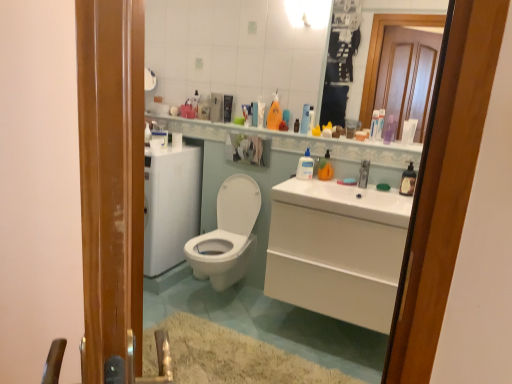
Where is `clear plastic bottle at upper center, which is counted as the first toiletry, starting from the right`? The height and width of the screenshot is (384, 512). clear plastic bottle at upper center, which is counted as the first toiletry, starting from the right is located at coordinates (390, 129).

What are the coordinates of `translucent plastic bottle at upper center, the 6th toiletry when ordered from right to left` in the screenshot? It's located at (296, 125).

How much space does translucent plastic bottle at upper center, the 6th toiletry when ordered from right to left, occupy vertically?

translucent plastic bottle at upper center, the 6th toiletry when ordered from right to left, is 4.13 inches in height.

Describe the element at coordinates (305, 119) in the screenshot. This screenshot has height=384, width=512. I see `clear plastic bottle at upper center, arranged as the fifth toiletry when viewed from the right` at that location.

What do you see at coordinates (227, 235) in the screenshot? I see `white glossy toilet at center` at bounding box center [227, 235].

What do you see at coordinates (359, 176) in the screenshot? I see `white glossy sink at upper center, arranged as the 2th sink when viewed from the left` at bounding box center [359, 176].

Identify the location of matte plastic bottle at upper center, which ranks as the eighth toiletry in right-to-left order. This screenshot has height=384, width=512. (246, 114).

From a real-world perspective, is clear plastic bottle at center, the second cleaning product when ordered from left to right, beneath white glossy shelf at upper center?

→ Yes, from a real-world perspective, clear plastic bottle at center, the second cleaning product when ordered from left to right, is below white glossy shelf at upper center.

Is clear plastic bottle at center, the 3th cleaning product when ordered from back to front, in contact with white glossy shelf at upper center?

No.

The height and width of the screenshot is (384, 512). I want to click on balustrade in front of the clear plastic bottle at center, the 3th cleaning product when ordered from back to front, so click(x=292, y=140).

Can you tell me how much clear plastic bottle at center, the second cleaning product when ordered from left to right, and white glossy shelf at upper center differ in facing direction?

clear plastic bottle at center, the second cleaning product when ordered from left to right, and white glossy shelf at upper center are facing 38.5 degrees away from each other.

Based on the photo, from the image's perspective, is matte plastic container at upper center, the 2th toiletry viewed from the left, under translucent plastic tube at upper center, the second toiletry in the right-to-left sequence?

No, from the image's perspective, matte plastic container at upper center, the 2th toiletry viewed from the left, is not beneath translucent plastic tube at upper center, the second toiletry in the right-to-left sequence.

Which object is more forward, matte plastic container at upper center, which is counted as the 7th toiletry, starting from the right, or translucent plastic tube at upper center, which appears as the 7th toiletry when viewed from the left?

translucent plastic tube at upper center, which appears as the 7th toiletry when viewed from the left, is more forward.

This screenshot has width=512, height=384. What are the coordinates of `the 3rd toiletry located beneath the translucent plastic tube at upper center, the second toiletry in the right-to-left sequence (from a real-world perspective)` in the screenshot? It's located at (260, 112).

Considering the relative sizes of matte plastic container at upper center, the 2th toiletry viewed from the left, and translucent plastic tube at upper center, which appears as the 7th toiletry when viewed from the left, in the image provided, is matte plastic container at upper center, the 2th toiletry viewed from the left, bigger than translucent plastic tube at upper center, which appears as the 7th toiletry when viewed from the left,?

Actually, matte plastic container at upper center, the 2th toiletry viewed from the left, might be smaller than translucent plastic tube at upper center, which appears as the 7th toiletry when viewed from the left.

Is white glossy shelf at upper center oriented towards white glossy light fixture at upper center?

No.

Is white glossy shelf at upper center with white glossy light fixture at upper center?

No, white glossy shelf at upper center is not with white glossy light fixture at upper center.

Considering the sizes of objects white glossy shelf at upper center and white glossy light fixture at upper center in the image provided, who is taller, white glossy shelf at upper center or white glossy light fixture at upper center?

With more height is white glossy light fixture at upper center.

Based on the photo, does white glossy toilet at center have a greater height compared to white glossy vanity at lower right?

Correct, white glossy toilet at center is much taller as white glossy vanity at lower right.

Which is less distant, (x=230, y=177) or (x=379, y=268)?

Point (x=230, y=177) is farther from the camera than point (x=379, y=268).

Considering the relative positions of white glossy toilet at center and white glossy vanity at lower right in the image provided, is white glossy toilet at center to the right of white glossy vanity at lower right from the viewer's perspective?

In fact, white glossy toilet at center is to the left of white glossy vanity at lower right.

What are the coordinates of `toilet that appears above the white glossy vanity at lower right (from the image's perspective)` in the screenshot? It's located at (227, 235).

Does point (361, 183) lie in front of point (304, 143)?

Yes, it is in front of point (304, 143).

Do you think white glossy sink at upper center, placed as the first sink when sorted from right to left, is within white glossy shelf at upper center, or outside of it?

white glossy sink at upper center, placed as the first sink when sorted from right to left, is located beyond the bounds of white glossy shelf at upper center.

Is white glossy sink at upper center, placed as the first sink when sorted from right to left, positioned behind white glossy shelf at upper center?

No, it is in front of white glossy shelf at upper center.

Starting from the white glossy sink at center, the 2th sink when ordered from right to left, which toiletry is the 8th one behind? Please provide its 2D coordinates.

[(246, 114)]

Considering the relative sizes of matte plastic bottle at upper center, which ranks as the eighth toiletry in right-to-left order, and white glossy sink at center, arranged as the first sink when viewed from the left, in the image provided, is matte plastic bottle at upper center, which ranks as the eighth toiletry in right-to-left order, taller than white glossy sink at center, arranged as the first sink when viewed from the left,?

Incorrect, the height of matte plastic bottle at upper center, which ranks as the eighth toiletry in right-to-left order, is not larger of that of white glossy sink at center, arranged as the first sink when viewed from the left.

Considering the positions of objects matte plastic bottle at upper center, marked as the 1th toiletry in a left-to-right arrangement, and white glossy sink at center, arranged as the first sink when viewed from the left, in the image provided, who is in front, matte plastic bottle at upper center, marked as the 1th toiletry in a left-to-right arrangement, or white glossy sink at center, arranged as the first sink when viewed from the left,?

white glossy sink at center, arranged as the first sink when viewed from the left.

Is matte plastic bottle at upper center, which ranks as the eighth toiletry in right-to-left order, wider or thinner than white glossy sink at center, arranged as the first sink when viewed from the left?

Considering their sizes, matte plastic bottle at upper center, which ranks as the eighth toiletry in right-to-left order, looks slimmer than white glossy sink at center, arranged as the first sink when viewed from the left.

Which is in front, point (250, 105) or point (364, 294)?

The point (364, 294) is more forward.

Considering the sizes of objects matte plastic bottle at upper center, marked as the 1th toiletry in a left-to-right arrangement, and white glossy vanity at lower right in the image provided, who is shorter, matte plastic bottle at upper center, marked as the 1th toiletry in a left-to-right arrangement, or white glossy vanity at lower right?

matte plastic bottle at upper center, marked as the 1th toiletry in a left-to-right arrangement, is shorter.

Is matte plastic bottle at upper center, marked as the 1th toiletry in a left-to-right arrangement, with white glossy vanity at lower right?

matte plastic bottle at upper center, marked as the 1th toiletry in a left-to-right arrangement, and white glossy vanity at lower right are clearly separated.

Looking at this image, can white glossy vanity at lower right be found inside matte plastic bottle at upper center, which ranks as the eighth toiletry in right-to-left order?

Definitely not — white glossy vanity at lower right is not inside matte plastic bottle at upper center, which ranks as the eighth toiletry in right-to-left order.

Find the location of `the 2nd cleaning product to the right of the white glossy shelf at upper center, counting from the anchor's position`. the 2nd cleaning product to the right of the white glossy shelf at upper center, counting from the anchor's position is located at coordinates (305, 167).

From a real-world perspective, which toiletry is the 3rd one underneath the translucent plastic tube at upper center, which appears as the 7th toiletry when viewed from the left? Please provide its 2D coordinates.

[(260, 112)]

Estimate the real-world distances between objects in this image. Which object is closer to clear plastic bottle at upper center, arranged as the fifth toiletry when viewed from the right, orange matte bottle at upper center, which ranks as the 1th cleaning product in back-to-front order, or matte plastic container at upper center, the 2th toiletry viewed from the left?

orange matte bottle at upper center, which ranks as the 1th cleaning product in back-to-front order, lies closer to clear plastic bottle at upper center, arranged as the fifth toiletry when viewed from the right, than the other object.

Considering their positions, is translucent plastic tube at upper center, which appears as the 7th toiletry when viewed from the left, positioned further to clear plastic bottle at center, the 3th cleaning product viewed from the right, than translucent plastic soap dispenser at upper center, the 4th toiletry viewed from the right?

Among the two, translucent plastic soap dispenser at upper center, the 4th toiletry viewed from the right, is located further to clear plastic bottle at center, the 3th cleaning product viewed from the right.

Which object lies further to the anchor point clear plastic bottle at center, the 3th cleaning product when ordered from back to front, matte plastic bottle at upper center, which ranks as the eighth toiletry in right-to-left order, or translucent plastic bottle at right, which ranks as the 4th cleaning product in left-to-right order?

translucent plastic bottle at right, which ranks as the 4th cleaning product in left-to-right order, lies further to clear plastic bottle at center, the 3th cleaning product when ordered from back to front, than the other object.

Consider the image. Estimate the real-world distances between objects in this image. Which object is further from white glossy vanity at lower right, white glossy shelf at upper center or matte plastic container at upper center, which is counted as the 7th toiletry, starting from the right?

matte plastic container at upper center, which is counted as the 7th toiletry, starting from the right, lies further to white glossy vanity at lower right than the other object.

Which object lies further to the anchor point translucent plastic tube at upper center, which appears as the 7th toiletry when viewed from the left, white glossy sink at upper center, arranged as the 2th sink when viewed from the left, or white glossy sink at center, arranged as the first sink when viewed from the left?

The object further to translucent plastic tube at upper center, which appears as the 7th toiletry when viewed from the left, is white glossy sink at center, arranged as the first sink when viewed from the left.

Considering their positions, is translucent plastic bottle at right, the 1th cleaning product in the right-to-left sequence, positioned further to clear plastic bottle at upper center, the fourth toiletry viewed from the left, than white glossy sink at center, the 2th sink when ordered from right to left?

translucent plastic bottle at right, the 1th cleaning product in the right-to-left sequence, lies further to clear plastic bottle at upper center, the fourth toiletry viewed from the left, than the other object.

Estimate the real-world distances between objects in this image. Which object is further from white glossy sink at center, the 2th sink when ordered from right to left, white glossy shelf at upper center or translucent plastic bottle at upper center, the 3th toiletry positioned from the left?

translucent plastic bottle at upper center, the 3th toiletry positioned from the left, is further to white glossy sink at center, the 2th sink when ordered from right to left.

Which object lies further to the anchor point white glossy sink at center, arranged as the first sink when viewed from the left, matte plastic bottle at upper center, marked as the 1th toiletry in a left-to-right arrangement, or clear plastic bottle at center, the second cleaning product viewed from the front?

matte plastic bottle at upper center, marked as the 1th toiletry in a left-to-right arrangement.

Locate an element on the screen. mirror between white glossy light fixture at upper center and clear plastic bottle at upper center, the fourth toiletry viewed from the left, in the vertical direction is located at coordinates (401, 71).

This screenshot has height=384, width=512. I want to click on mirror located between clear plastic bottle at upper center, the fourth toiletry viewed from the left, and clear plastic bottle at upper center, which is counted as the first toiletry, starting from the right, in the left-right direction, so click(401, 71).

Identify the location of mirror between orange matte bottle at upper center, which ranks as the 1th cleaning product in back-to-front order, and clear plastic bottle at upper center, placed as the 8th toiletry when sorted from left to right, from left to right. This screenshot has height=384, width=512. (401, 71).

Where is `vanity between white glossy toilet at center and white glossy sink at center, arranged as the first sink when viewed from the left, from left to right`? vanity between white glossy toilet at center and white glossy sink at center, arranged as the first sink when viewed from the left, from left to right is located at coordinates (337, 250).